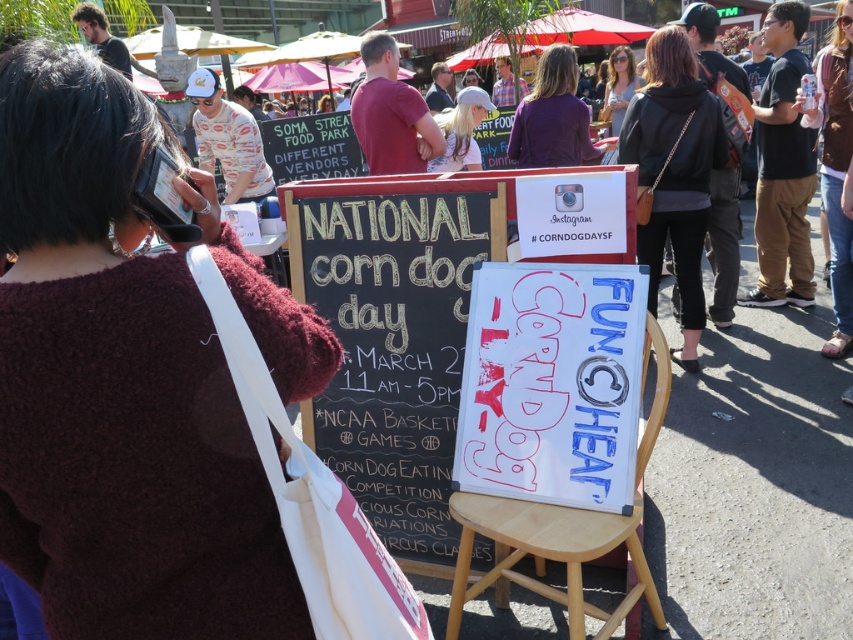
Question: Is white paper sign at center closer to the viewer compared to matte purple shirt at upper center?

Choices:
 (A) no
 (B) yes

Answer: (B)

Question: Estimate the real-world distances between objects in this image. Which object is closer to the chalkboard sign at center?

Choices:
 (A) brown leather jacket at upper center
 (B) matte purple shirt at upper center
 (C) black leather jacket at upper center
 (D) white cotton hat at center

Answer: (C)

Question: Does brown leather jacket at upper center have a smaller size compared to purple fabric purse at upper center?

Choices:
 (A) yes
 (B) no

Answer: (B)

Question: Is black leather jacket at upper center in front of matte purple shirt at upper center?

Choices:
 (A) no
 (B) yes

Answer: (B)

Question: Among these objects, which one is nearest to the camera?

Choices:
 (A) brown fuzzy sweater at upper left
 (B) matte purple shirt at upper center
 (C) white paper sign at center

Answer: (A)

Question: Estimate the real-world distances between objects in this image. Which object is closer to the purple fabric purse at upper center?

Choices:
 (A) white paper sign at center
 (B) black leather jacket at upper center
 (C) light brown wooden stool at center
 (D) brown fuzzy sweater at upper left

Answer: (B)